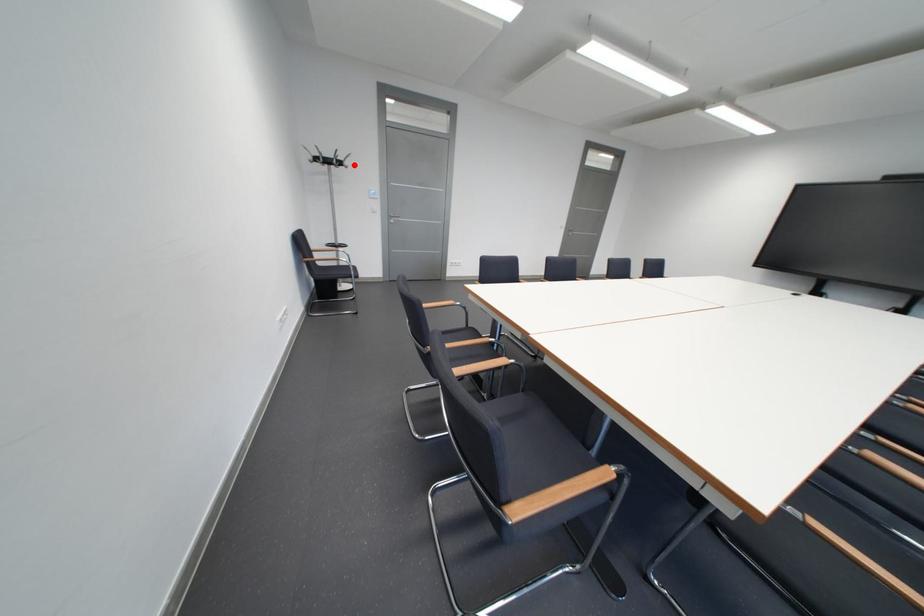
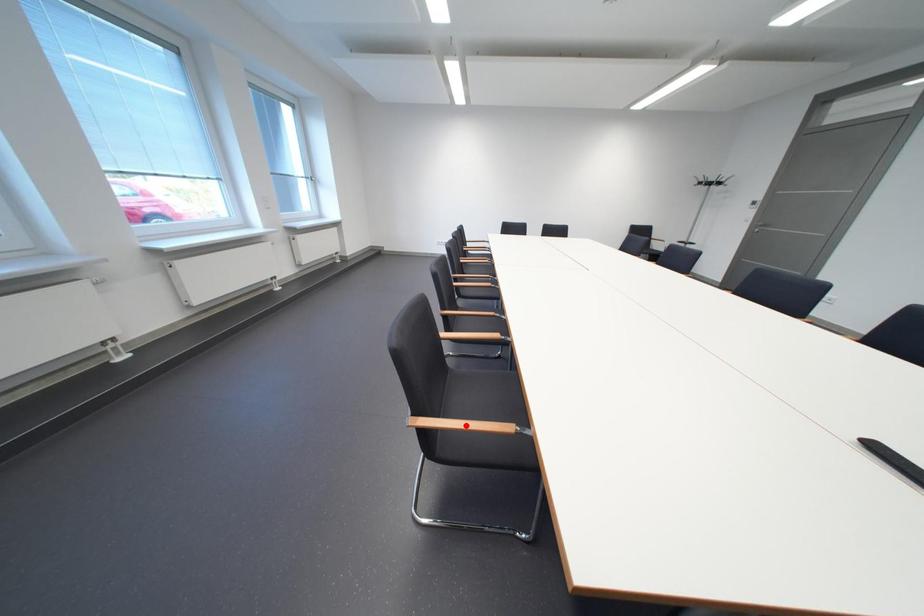
I am providing you with two images of the same scene from different viewpoints. A red point is marked on the first image and another point is marked on the second image. Is the red point in image1 aligned with the point shown in image2?

No